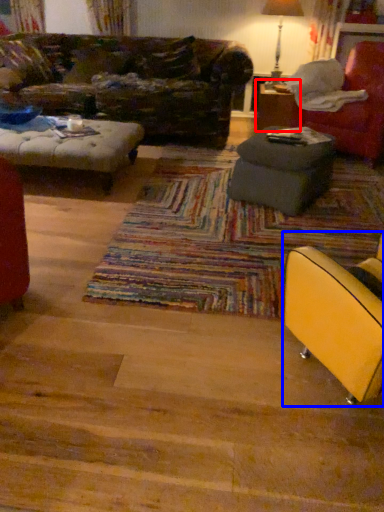
Question: Which object appears closest to the camera in this image, table (highlighted by a red box) or chair (highlighted by a blue box)?

Choices:
 (A) table
 (B) chair

Answer: (B)